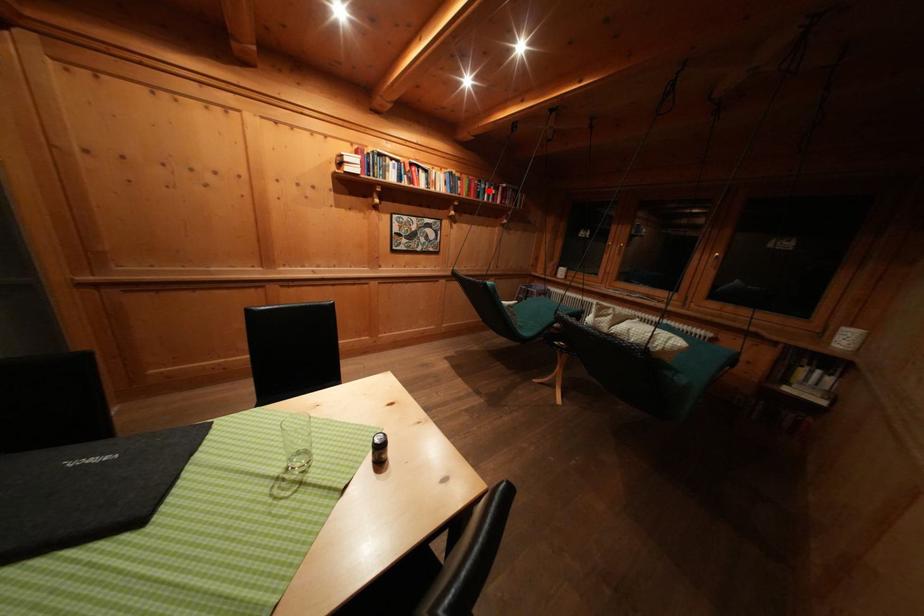
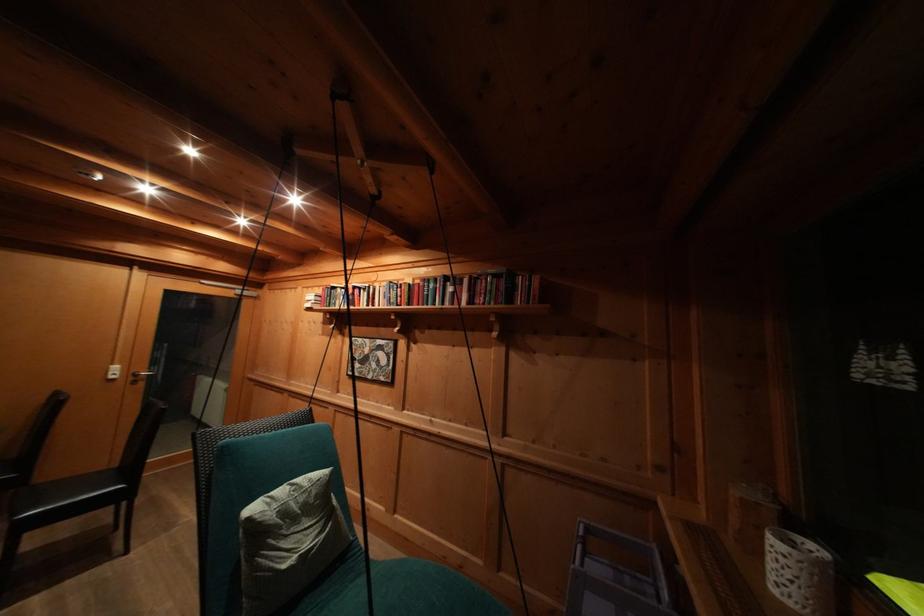
Find the pixel in the second image that matches the highlighted location in the first image.

(438, 291)